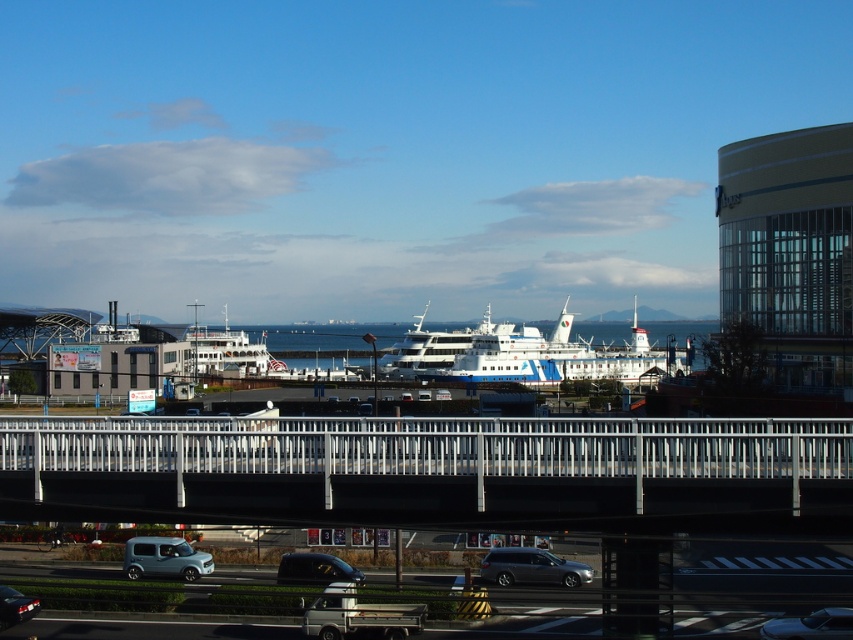
How far apart are silver metallic bridge at center and white glossy ferry at center?

A distance of 100.93 meters exists between silver metallic bridge at center and white glossy ferry at center.

The height and width of the screenshot is (640, 853). Describe the element at coordinates (432, 470) in the screenshot. I see `silver metallic bridge at center` at that location.

This screenshot has height=640, width=853. What do you see at coordinates (432, 470) in the screenshot? I see `silver metallic bridge at center` at bounding box center [432, 470].

Find the location of `silver metallic bridge at center`. silver metallic bridge at center is located at coordinates 432,470.

Is metallic gray station wagon at center wider than metallic blue suv at lower left?

Indeed, metallic gray station wagon at center has a greater width compared to metallic blue suv at lower left.

Which is above, metallic gray station wagon at center or metallic blue suv at lower left?

Positioned higher is metallic blue suv at lower left.

Does point (560, 576) come closer to viewer compared to point (135, 538)?

Yes, point (560, 576) is in front of point (135, 538).

Identify the location of metallic gray station wagon at center. (532, 566).

Is metallic blue suv at lower left further to camera compared to matte black van at center?

Yes, it is.

Can you confirm if metallic blue suv at lower left is positioned below matte black van at center?

No, metallic blue suv at lower left is not below matte black van at center.

Describe the element at coordinates (164, 557) in the screenshot. This screenshot has height=640, width=853. I see `metallic blue suv at lower left` at that location.

Identify the location of metallic blue suv at lower left. (164, 557).